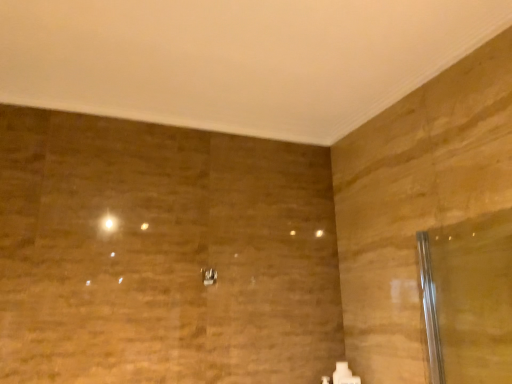
What do you see at coordinates (209, 276) in the screenshot? This screenshot has height=384, width=512. I see `matte brown shower at center` at bounding box center [209, 276].

At what (x,y) coordinates should I click in order to perform the action: click on matte brown shower at center. Please return your answer as a coordinate pair (x, y). Looking at the image, I should click on (209, 276).

You are a GUI agent. You are given a task and a screenshot of the screen. Output one action in this format:
    pyautogui.click(x=<x>, y=<y>)
    Task: Click on the matte brown shower at center
    
    Given the screenshot: What is the action you would take?
    pyautogui.click(x=209, y=276)